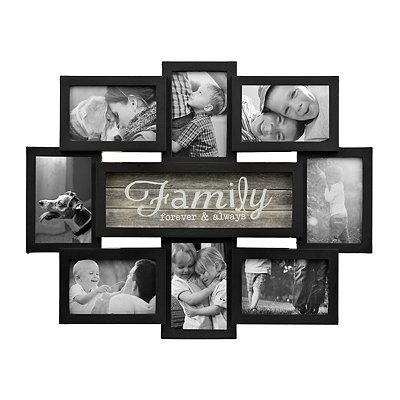
This screenshot has height=400, width=400. I want to click on black picture frame, so click(101, 99), click(194, 116), click(262, 118), click(326, 189), click(280, 268), click(209, 283), click(111, 271), click(63, 192), click(178, 208).